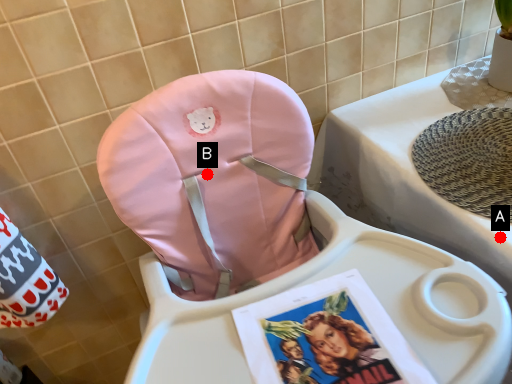
Question: Two points are circled on the image, labeled by A and B beside each circle. Which point appears farthest from the camera in this image?

Choices:
 (A) A is further
 (B) B is further

Answer: (B)